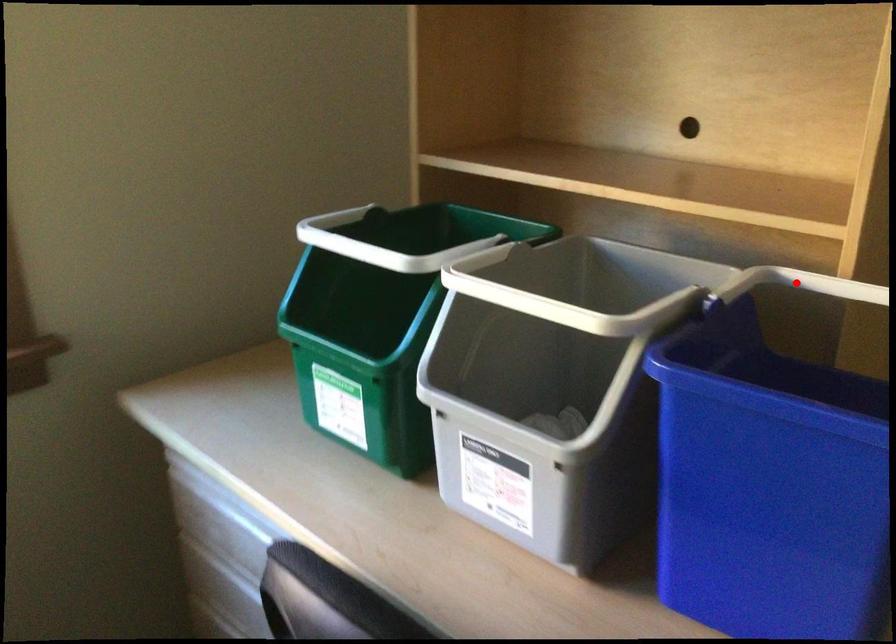
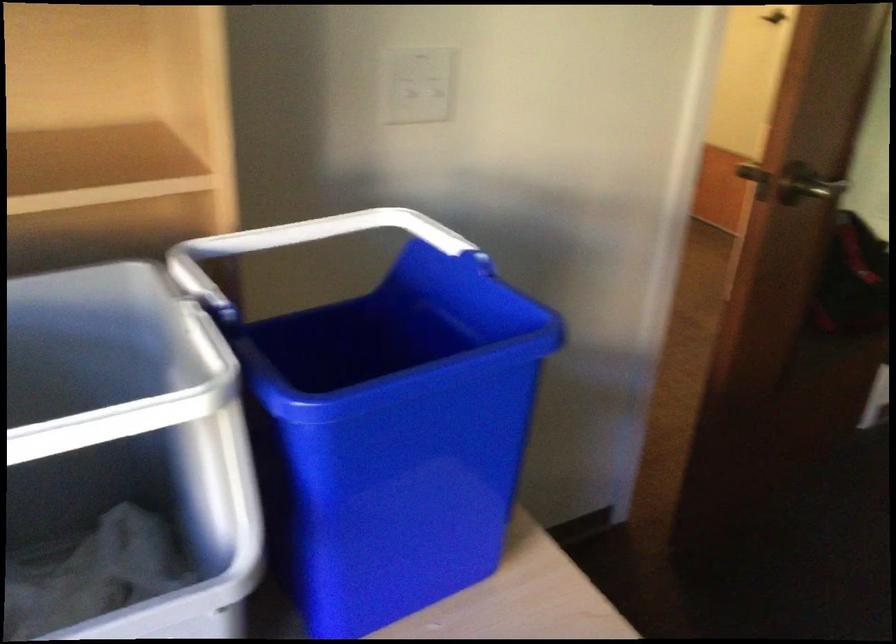
Question: I am providing you with two images of the same scene from different viewpoints. Given a red point in image1, look at the same physical point in image2. Is it:

Choices:
 (A) Closer to the viewpoint
 (B) Farther from the viewpoint

Answer: (A)